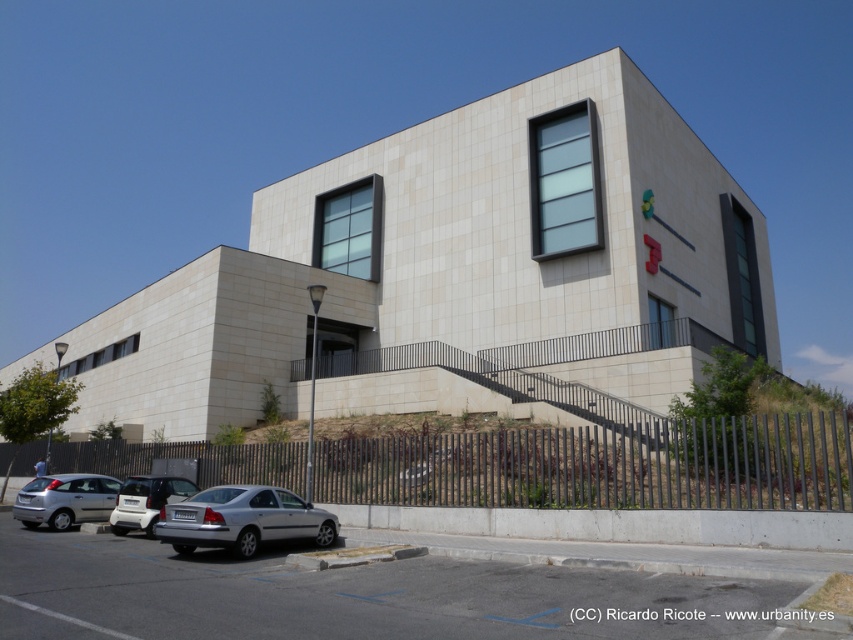
Who is higher up, metallic gray fence at lower center or silver metallic car at lower left?

silver metallic car at lower left

Find the location of `metallic gray fence at lower center`. metallic gray fence at lower center is located at coordinates (602, 465).

In the scene shown: Which is below, silver metallic hatchback at lower left or silver metallic car at lower left?

Positioned lower is silver metallic hatchback at lower left.

Between silver metallic hatchback at lower left and silver metallic car at lower left, which one is positioned higher?

silver metallic car at lower left is above.

Does point (103, 490) come in front of point (114, 508)?

No, it is behind (114, 508).

Find the location of `silver metallic hatchback at lower left`. silver metallic hatchback at lower left is located at coordinates (65, 499).

Is point (650, 600) positioned before point (283, 509)?

Yes, point (650, 600) is in front of point (283, 509).

Can you confirm if gray asphalt parking lot at lower center is wider than silver metallic car at lower center?

Yes, gray asphalt parking lot at lower center is wider than silver metallic car at lower center.

Where is `gray asphalt parking lot at lower center`? gray asphalt parking lot at lower center is located at coordinates click(x=350, y=596).